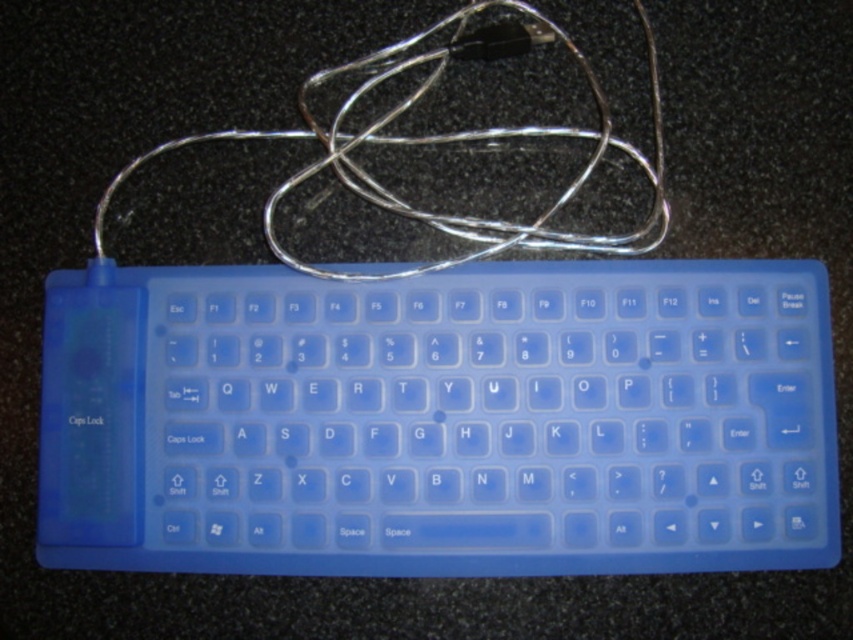
Question: Is translucent blue keyboard at center above silver metallic wire at upper center?

Choices:
 (A) no
 (B) yes

Answer: (A)

Question: Which point appears farthest from the camera in this image?

Choices:
 (A) (425, 269)
 (B) (576, 552)

Answer: (A)

Question: In this image, where is translucent blue keyboard at center located relative to silver metallic wire at upper center?

Choices:
 (A) below
 (B) above

Answer: (A)

Question: Which point is closer to the camera?

Choices:
 (A) silver metallic wire at upper center
 (B) translucent blue keyboard at center

Answer: (B)

Question: Does translucent blue keyboard at center come behind silver metallic wire at upper center?

Choices:
 (A) no
 (B) yes

Answer: (A)

Question: Which point is farther to the camera?

Choices:
 (A) (807, 276)
 (B) (535, 228)

Answer: (B)